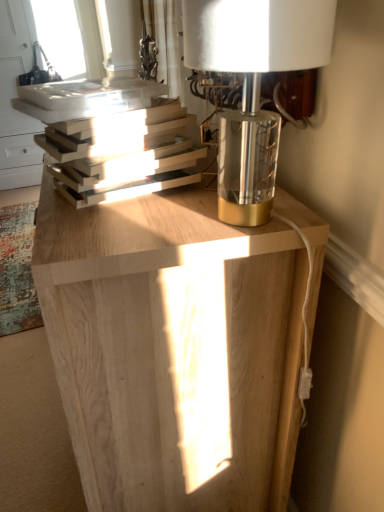
Question: Do you think hardcover books at left is within natural wood table at center, or outside of it?

Choices:
 (A) outside
 (B) inside

Answer: (A)

Question: Is point pos(165,104) positioned closer to the camera than point pos(236,236)?

Choices:
 (A) closer
 (B) farther

Answer: (B)

Question: Estimate the real-world distances between objects in this image. Which object is closer to the metallic gold base at upper right?

Choices:
 (A) natural wood table at center
 (B) clear glass window at upper left
 (C) hardcover books at left

Answer: (C)

Question: Which object is positioned farthest from the metallic gold base at upper right?

Choices:
 (A) clear glass window at upper left
 (B) hardcover books at left
 (C) natural wood table at center

Answer: (A)